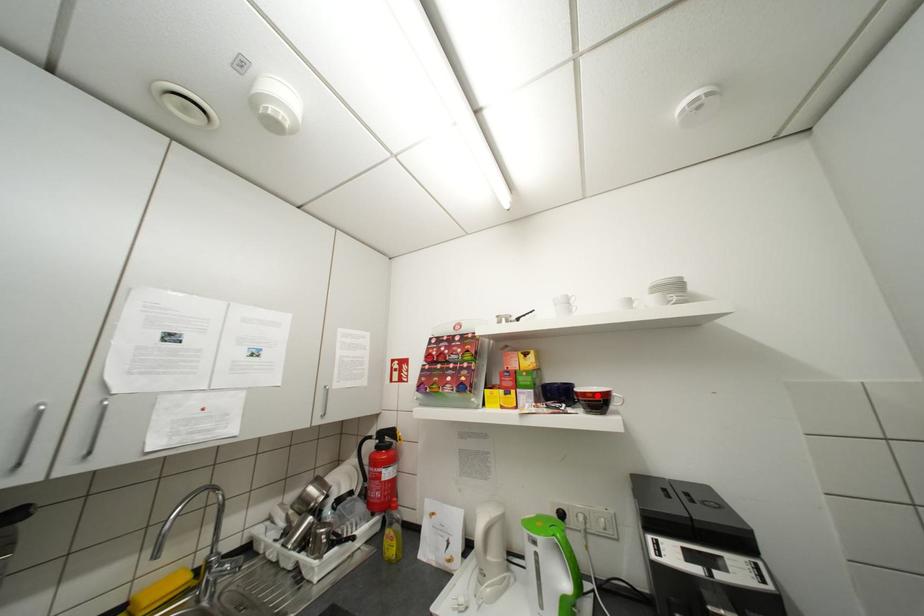
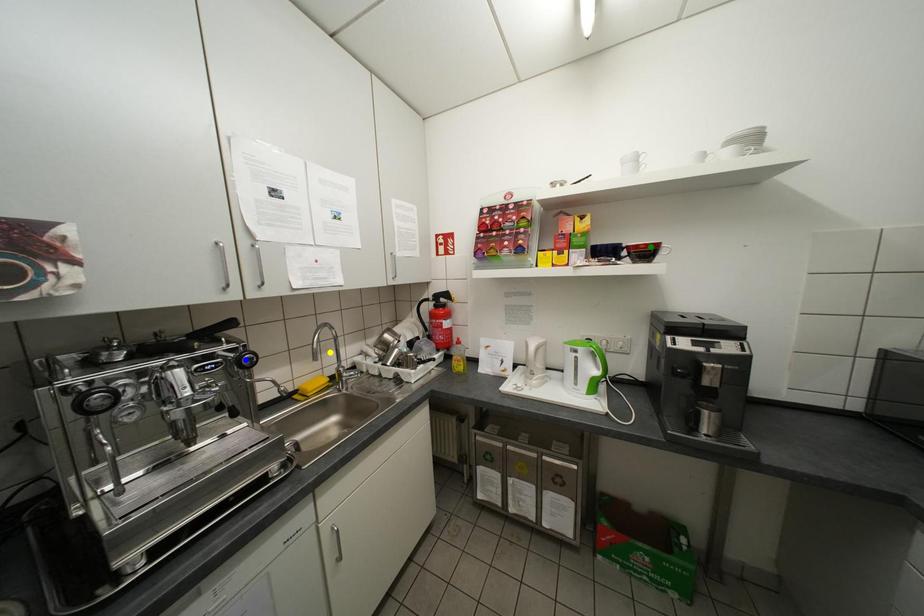
Question: I am providing you with two images of the same scene from different viewpoints. A red point is marked on the first image. You are given multiple points on the second image. Which mark in image 2 goes with the point in image 1?

Choices:
 (A) green point
 (B) blue point
 (C) yellow point

Answer: (A)